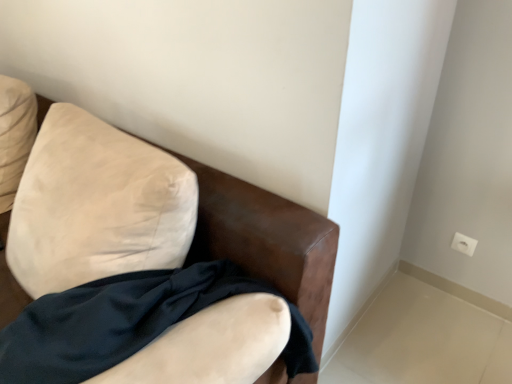
Question: From their relative heights in the image, would you say white plastic electric outlet at upper right is taller or shorter than suede-like beige armchair at upper left?

Choices:
 (A) short
 (B) tall

Answer: (A)

Question: Considering the positions of white plastic electric outlet at upper right and suede-like beige armchair at upper left in the image, is white plastic electric outlet at upper right wider or thinner than suede-like beige armchair at upper left?

Choices:
 (A) wide
 (B) thin

Answer: (B)

Question: Estimate the real-world distances between objects in this image. Which object is closer to the white plastic electric outlet at upper right?

Choices:
 (A) suede-like beige armchair at upper left
 (B) satin black fabric at lower left

Answer: (A)

Question: Considering the real-world distances, which object is closest to the white plastic electric outlet at upper right?

Choices:
 (A) satin black fabric at lower left
 (B) suede-like beige armchair at upper left

Answer: (B)